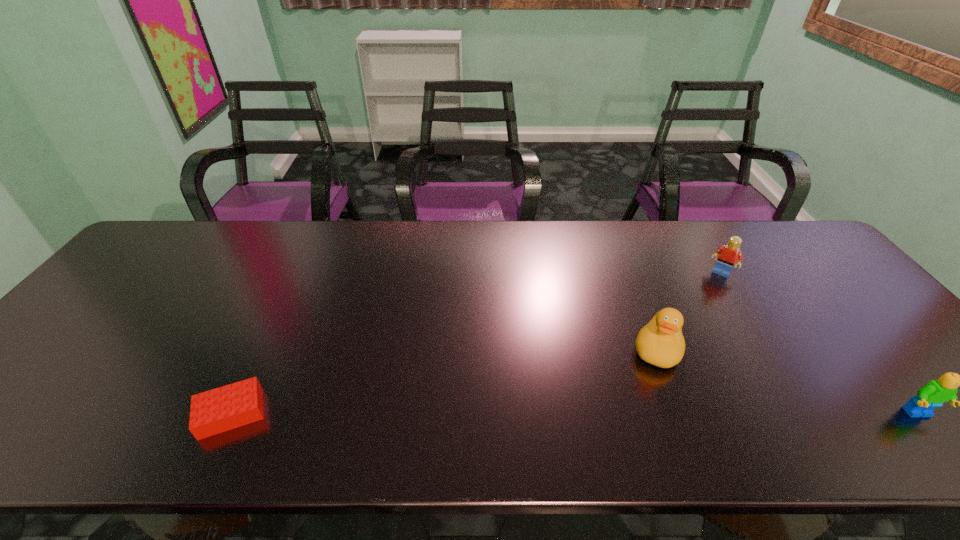
Image resolution: width=960 pixels, height=540 pixels. What are the coordinates of `vacant space that's between the farthest Lego and the rightmost Lego` in the screenshot? It's located at (820, 343).

This screenshot has width=960, height=540. In order to click on free space between the third object from left to right and the third object from right to left in this screenshot , I will do `click(689, 310)`.

The width and height of the screenshot is (960, 540). Identify the location of unoccupied area between the leftmost Lego and the second object from left to right. (444, 381).

The height and width of the screenshot is (540, 960). Find the location of `vacant space that is in between the second object from left to right and the shortest Lego`. vacant space that is in between the second object from left to right and the shortest Lego is located at coordinates click(444, 381).

I want to click on free space between the shortest object and the duck, so click(x=444, y=381).

You are a GUI agent. You are given a task and a screenshot of the screen. Output one action in this format:
    pyautogui.click(x=<x>, y=<y>)
    Task: Click on the free spot between the leftmost Lego and the farthest object
    The image size is (960, 540).
    Given the screenshot: What is the action you would take?
    pyautogui.click(x=476, y=343)

Where is `blank region between the shortest object and the rightmost Lego`? This screenshot has width=960, height=540. blank region between the shortest object and the rightmost Lego is located at coordinates (575, 414).

Find the location of a particular element. This screenshot has height=540, width=960. free space between the leftmost Lego and the third object from right to left is located at coordinates (444, 381).

The width and height of the screenshot is (960, 540). In order to click on free point between the rightmost object and the shortest Lego in this screenshot , I will do `click(575, 414)`.

Locate an element on the screen. This screenshot has height=540, width=960. free spot between the rightmost Lego and the shortest Lego is located at coordinates (575, 414).